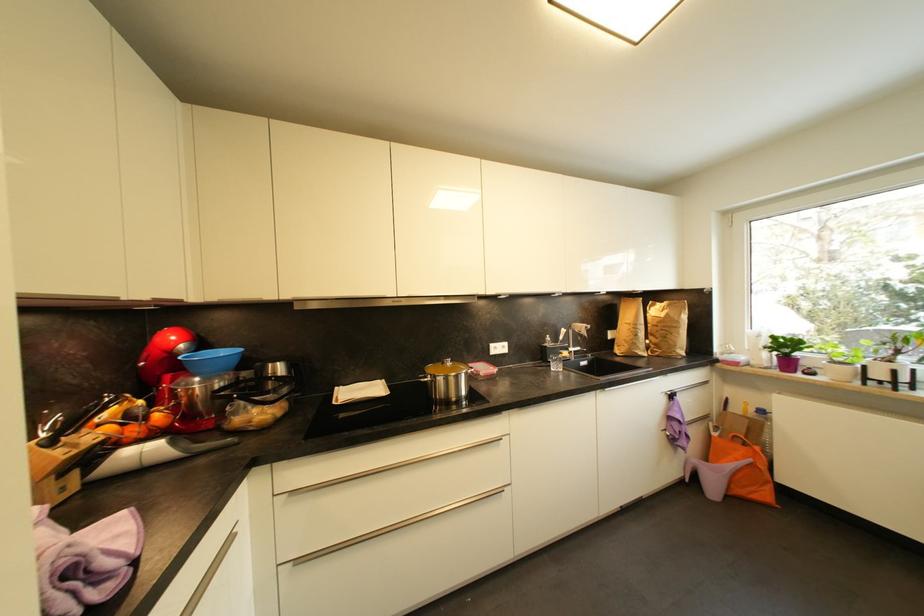
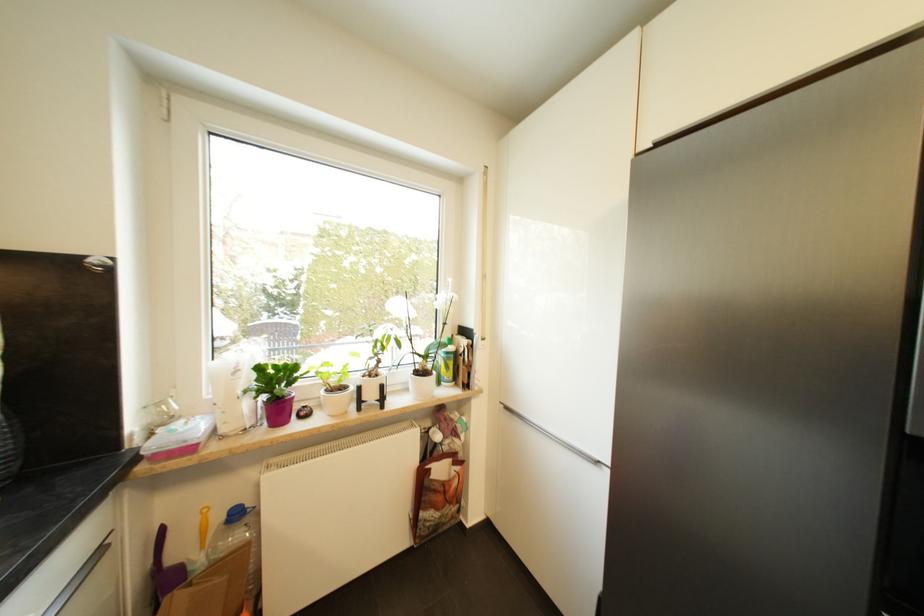
Where in the second image is the point corresponding to (793,365) from the first image?

(285, 411)